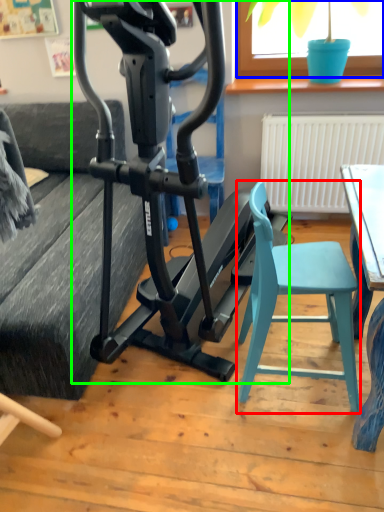
Question: Which object is positioned farthest from folding chair (highlighted by a red box)? Select from window screen (highlighted by a blue box) and stationary bicycle (highlighted by a green box).

Choices:
 (A) window screen
 (B) stationary bicycle

Answer: (A)